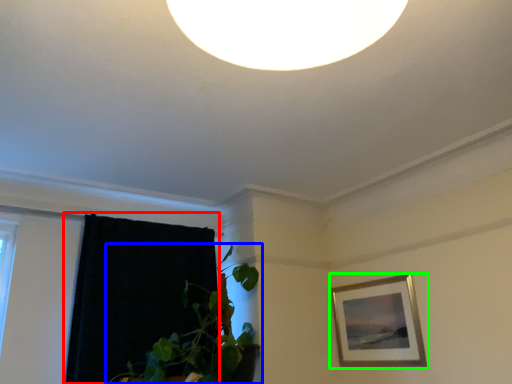
Question: Estimate the real-world distances between objects in this image. Which object is closer to curtain (highlighted by a red box), houseplant (highlighted by a blue box) or picture frame (highlighted by a green box)?

Choices:
 (A) houseplant
 (B) picture frame

Answer: (A)